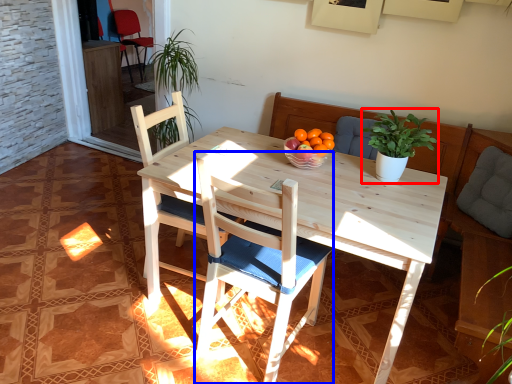
Question: Which of the following is the closest to the observer, houseplant (highlighted by a red box) or chair (highlighted by a blue box)?

Choices:
 (A) houseplant
 (B) chair

Answer: (B)